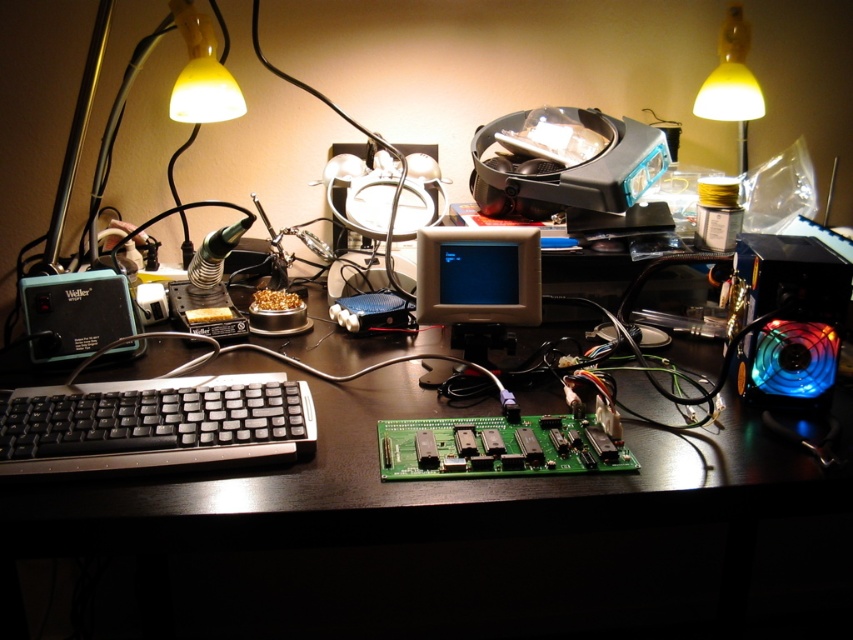
Question: Among these objects, which one is nearest to the camera?

Choices:
 (A) matte plastic monitor at center
 (B) black plastic keyboard at lower left

Answer: (B)

Question: Which of the following is the farthest from the observer?

Choices:
 (A) (73, 403)
 (B) (473, 289)

Answer: (B)

Question: Is black plastic keyboard at lower left positioned at the back of matte plastic monitor at center?

Choices:
 (A) yes
 (B) no

Answer: (B)

Question: Which point appears closest to the camera in this image?

Choices:
 (A) (178, 456)
 (B) (432, 266)

Answer: (A)

Question: Can you confirm if black plastic keyboard at lower left is positioned to the left of matte plastic monitor at center?

Choices:
 (A) yes
 (B) no

Answer: (A)

Question: Can you confirm if black plastic keyboard at lower left is positioned to the right of matte plastic monitor at center?

Choices:
 (A) no
 (B) yes

Answer: (A)